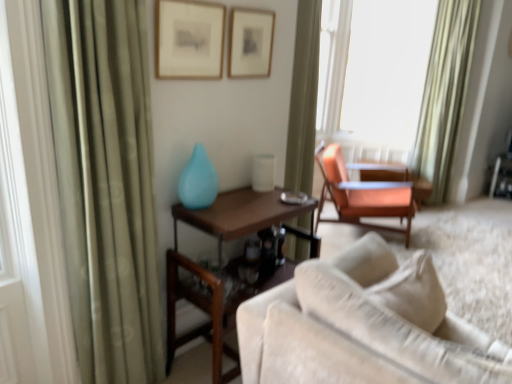
Question: Should I look upward or downward to see beige fabric couch at lower right?

Choices:
 (A) down
 (B) up

Answer: (A)

Question: Is matte gold picture frame at upper center, positioned as the second picture frame in left-to-right order, closer to the viewer compared to beige fabric couch at lower right?

Choices:
 (A) yes
 (B) no

Answer: (B)

Question: From the image's perspective, does matte gold picture frame at upper center, the first picture frame when ordered from back to front, appear lower than beige fabric couch at lower right?

Choices:
 (A) yes
 (B) no

Answer: (B)

Question: Is matte gold picture frame at upper center, the first picture frame when ordered from back to front, facing towards beige fabric couch at lower right?

Choices:
 (A) yes
 (B) no

Answer: (B)

Question: From the image's perspective, is matte gold picture frame at upper center, which ranks as the 1th picture frame in right-to-left order, over beige fabric couch at lower right?

Choices:
 (A) yes
 (B) no

Answer: (A)

Question: Considering the relative sizes of matte gold picture frame at upper center, the second picture frame viewed from the front, and beige fabric couch at lower right in the image provided, is matte gold picture frame at upper center, the second picture frame viewed from the front, shorter than beige fabric couch at lower right?

Choices:
 (A) yes
 (B) no

Answer: (A)

Question: From a real-world perspective, is matte gold picture frame at upper center, which ranks as the 1th picture frame in right-to-left order, physically below beige fabric couch at lower right?

Choices:
 (A) no
 (B) yes

Answer: (A)

Question: Can you confirm if matte glass vase at center is wider than white glossy table lamp at center?

Choices:
 (A) yes
 (B) no

Answer: (B)

Question: Does matte glass vase at center have a larger size compared to white glossy table lamp at center?

Choices:
 (A) yes
 (B) no

Answer: (A)

Question: Does matte glass vase at center appear on the right side of white glossy table lamp at center?

Choices:
 (A) no
 (B) yes

Answer: (A)

Question: Can you confirm if matte glass vase at center is smaller than white glossy table lamp at center?

Choices:
 (A) no
 (B) yes

Answer: (A)

Question: Is white glossy table lamp at center a part of matte glass vase at center?

Choices:
 (A) no
 (B) yes

Answer: (A)

Question: Does matte glass vase at center appear on the left side of white glossy table lamp at center?

Choices:
 (A) yes
 (B) no

Answer: (A)

Question: Does wooden table at center, the first table in the left-to-right sequence, appear on the right side of matte orange table at right, the 1th table positioned from the back?

Choices:
 (A) yes
 (B) no

Answer: (B)